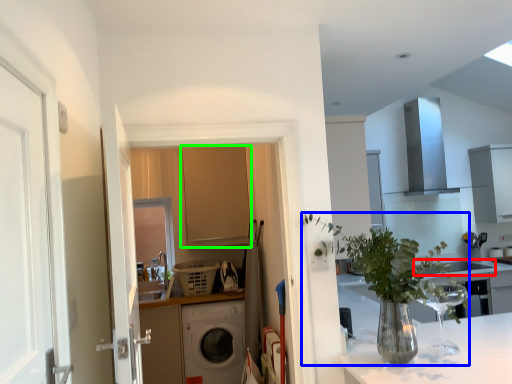
Question: Considering the real-world distances, which object is farthest from sink (highlighted by a red box)? houseplant (highlighted by a blue box) or cabinetry (highlighted by a green box)?

Choices:
 (A) houseplant
 (B) cabinetry

Answer: (A)